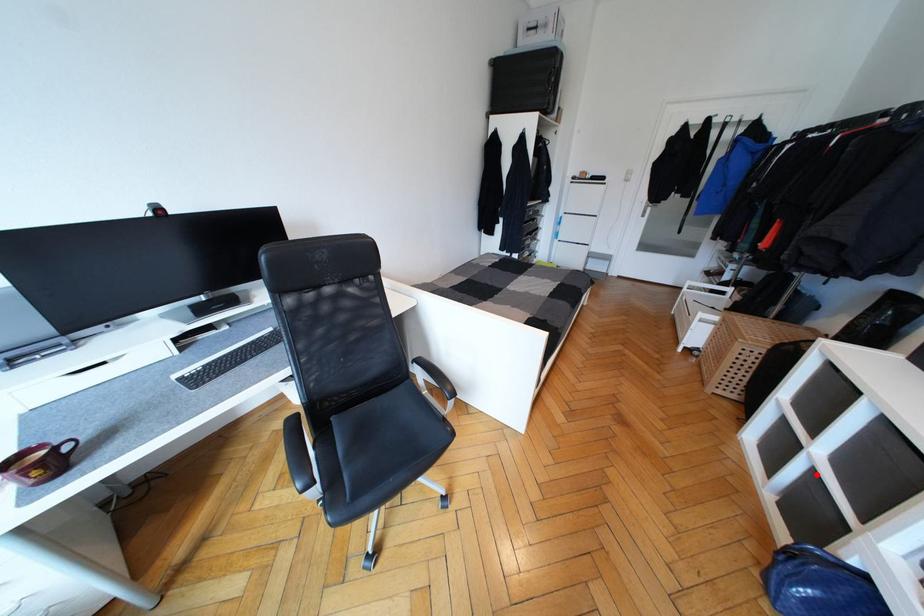
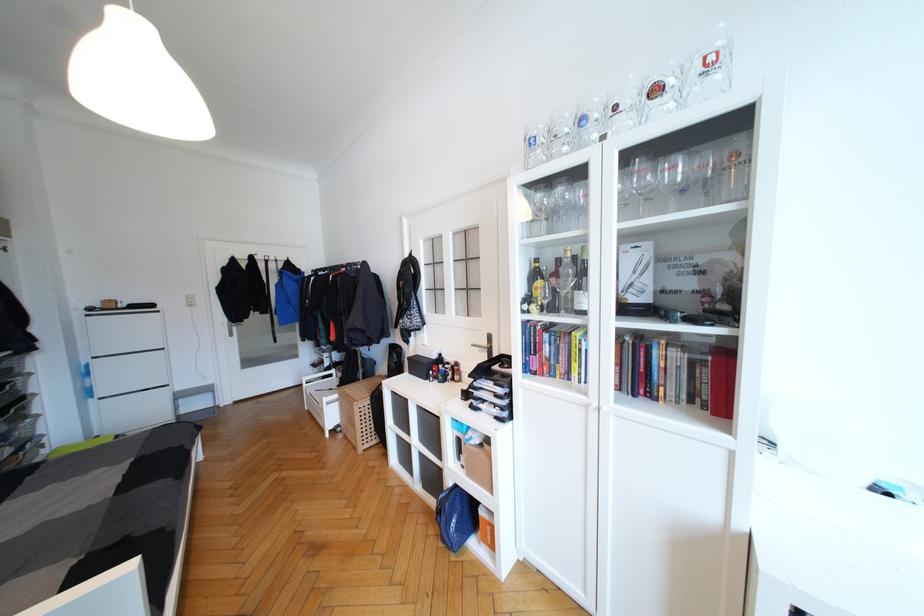
Find the pixel in the second image that matches the highlighted location in the first image.

(423, 456)